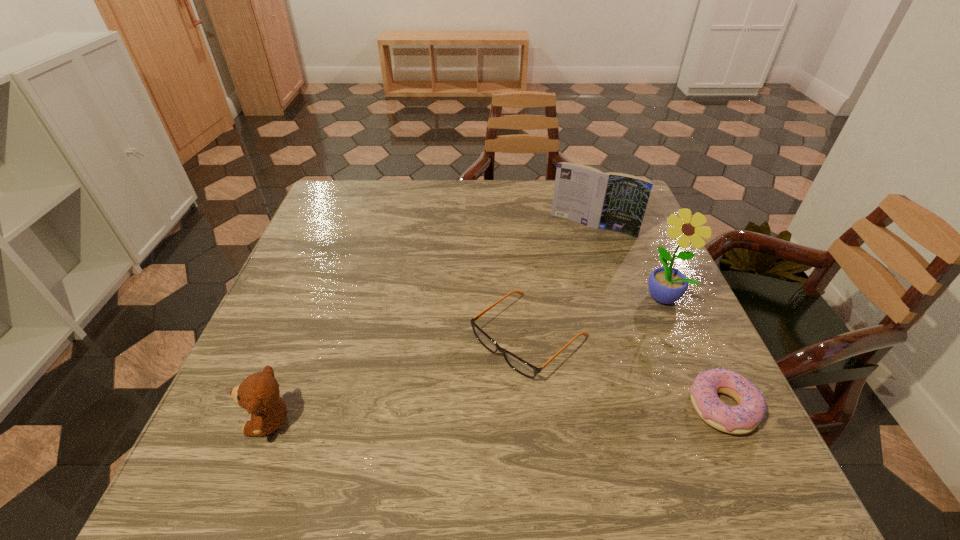
You are a GUI agent. You are given a task and a screenshot of the screen. Output one action in this format:
    pyautogui.click(x=<x>, y=<y>)
    Task: Click on the leftmost object
    
    Given the screenshot: What is the action you would take?
    pyautogui.click(x=259, y=393)

Where is `the third tallest object`? the third tallest object is located at coordinates [259, 393].

Identify the location of doughnut. This screenshot has height=540, width=960. (743, 418).

Find the location of a particular element. This screenshot has height=540, width=960. the tallest object is located at coordinates (666, 285).

The height and width of the screenshot is (540, 960). What are the coordinates of `the farthest object` in the screenshot? It's located at (613, 201).

Locate an element on the screen. The height and width of the screenshot is (540, 960). the second tallest object is located at coordinates (613, 201).

The image size is (960, 540). Find the location of `spectacles`. spectacles is located at coordinates click(x=524, y=368).

At what (x,y) coordinates should I click in order to perform the action: click on free space located 0.060m on the face of the third tallest object. Please return your answer as a coordinate pair (x, y). Image resolution: width=960 pixels, height=540 pixels. Looking at the image, I should click on (215, 421).

Image resolution: width=960 pixels, height=540 pixels. Find the location of `free region located 0.250m on the left of the doughnut`. free region located 0.250m on the left of the doughnut is located at coordinates (554, 407).

You are a GUI agent. You are given a task and a screenshot of the screen. Output one action in this format:
    pyautogui.click(x=<x>, y=<y>)
    Task: Click on the vacant space positioned on the front-facing side of the sunflower
    Image resolution: width=960 pixels, height=540 pixels.
    Given the screenshot: What is the action you would take?
    pyautogui.click(x=570, y=401)